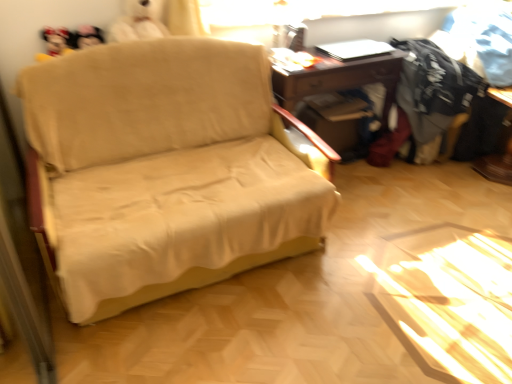
Describe the element at coordinates (485, 38) in the screenshot. I see `black printed fabric at upper right, which is the 1th clothing from right to left` at that location.

You are a GUI agent. You are given a task and a screenshot of the screen. Output one action in this format:
    pyautogui.click(x=<x>, y=<y>)
    Task: Click on the wooden desk at center
    This screenshot has height=384, width=512.
    Given the screenshot: What is the action you would take?
    pyautogui.click(x=338, y=78)

This screenshot has width=512, height=384. I want to click on beige fabric couch at center, so click(167, 170).

This screenshot has width=512, height=384. I want to click on black printed fabric at upper right, which is the 1th clothing from right to left, so pyautogui.click(x=485, y=38).

Considering the positions of objects beige fabric couch at center and dark gray cotton shirt at right, which is the 2th clothing in right-to-left order, in the image provided, who is behind, beige fabric couch at center or dark gray cotton shirt at right, which is the 2th clothing in right-to-left order,?

dark gray cotton shirt at right, which is the 2th clothing in right-to-left order.

From the image's perspective, is beige fabric couch at center above or below dark gray cotton shirt at right, which is the 2th clothing in right-to-left order?

From the image's perspective, beige fabric couch at center appears below dark gray cotton shirt at right, which is the 2th clothing in right-to-left order.

How distant is beige fabric couch at center from dark gray cotton shirt at right, which is the 2th clothing in right-to-left order?

beige fabric couch at center is 4.76 feet away from dark gray cotton shirt at right, which is the 2th clothing in right-to-left order.

Between point (194, 178) and point (429, 87), which one is positioned in front?

The point (194, 178) is closer to the camera.

Can you confirm if dark gray cotton shirt at right, which is the 2th clothing in right-to-left order, is smaller than wooden desk at center?

Yes, dark gray cotton shirt at right, which is the 2th clothing in right-to-left order, is smaller than wooden desk at center.

Does dark gray cotton shirt at right, arranged as the 1th clothing when viewed from the left, have a greater width compared to wooden desk at center?

Correct, the width of dark gray cotton shirt at right, arranged as the 1th clothing when viewed from the left, exceeds that of wooden desk at center.

Do you think dark gray cotton shirt at right, arranged as the 1th clothing when viewed from the left, is within wooden desk at center, or outside of it?

dark gray cotton shirt at right, arranged as the 1th clothing when viewed from the left, is not enclosed by wooden desk at center.

You are a GUI agent. You are given a task and a screenshot of the screen. Output one action in this format:
    pyautogui.click(x=<x>, y=<y>)
    Task: Click on the table that appears below the black printed fabric at upper right, which is the 1th clothing from right to left (from the image's perspective)
    This screenshot has height=384, width=512.
    Given the screenshot: What is the action you would take?
    pyautogui.click(x=338, y=78)

Between wooden desk at center and black printed fabric at upper right, which is the 1th clothing from right to left, which one has larger width?

black printed fabric at upper right, which is the 1th clothing from right to left.

Between wooden desk at center and black printed fabric at upper right, which is the 1th clothing from right to left, which one appears on the right side from the viewer's perspective?

black printed fabric at upper right, which is the 1th clothing from right to left, is more to the right.

Is wooden desk at center bigger than black printed fabric at upper right, arranged as the 2th clothing when viewed from the left?

Yes, wooden desk at center is bigger than black printed fabric at upper right, arranged as the 2th clothing when viewed from the left.

Identify the location of table that appears above the beige fabric couch at center (from the image's perspective). (338, 78).

Is the surface of wooden desk at center in direct contact with beige fabric couch at center?

No, wooden desk at center is not in contact with beige fabric couch at center.

Would you say wooden desk at center is outside beige fabric couch at center?

wooden desk at center lies outside beige fabric couch at center's area.

From the image's perspective, is wooden desk at center positioned above or below beige fabric couch at center?

Based on their image positions, wooden desk at center is located above beige fabric couch at center.

Is dark gray cotton shirt at right, which is the 2th clothing in right-to-left order, spatially inside beige fabric couch at center, or outside of it?

dark gray cotton shirt at right, which is the 2th clothing in right-to-left order, is outside beige fabric couch at center.

Considering the sizes of dark gray cotton shirt at right, which is the 2th clothing in right-to-left order, and beige fabric couch at center in the image, is dark gray cotton shirt at right, which is the 2th clothing in right-to-left order, bigger or smaller than beige fabric couch at center?

Considering their sizes, dark gray cotton shirt at right, which is the 2th clothing in right-to-left order, takes up less space than beige fabric couch at center.

Is dark gray cotton shirt at right, which is the 2th clothing in right-to-left order, thinner than beige fabric couch at center?

Yes, dark gray cotton shirt at right, which is the 2th clothing in right-to-left order, is thinner than beige fabric couch at center.

Between wooden desk at center and dark gray cotton shirt at right, arranged as the 1th clothing when viewed from the left, which one appears on the left side from the viewer's perspective?

From the viewer's perspective, wooden desk at center appears more on the left side.

From a real-world perspective, between wooden desk at center and dark gray cotton shirt at right, arranged as the 1th clothing when viewed from the left, who is vertically lower?

wooden desk at center, from a real-world perspective.

Between wooden desk at center and dark gray cotton shirt at right, arranged as the 1th clothing when viewed from the left, which one has smaller size?

dark gray cotton shirt at right, arranged as the 1th clothing when viewed from the left.

Which point is more distant from viewer, (341, 72) or (437, 110)?

The point (437, 110) is farther.

Does black printed fabric at upper right, arranged as the 2th clothing when viewed from the left, have a lesser height compared to dark gray cotton shirt at right, which is the 2th clothing in right-to-left order?

Correct, black printed fabric at upper right, arranged as the 2th clothing when viewed from the left, is not as tall as dark gray cotton shirt at right, which is the 2th clothing in right-to-left order.

Is black printed fabric at upper right, which is the 1th clothing from right to left, turned away from dark gray cotton shirt at right, arranged as the 1th clothing when viewed from the left?

No, black printed fabric at upper right, which is the 1th clothing from right to left, is not facing away from dark gray cotton shirt at right, arranged as the 1th clothing when viewed from the left.

How many degrees apart are the facing directions of black printed fabric at upper right, which is the 1th clothing from right to left, and dark gray cotton shirt at right, which is the 2th clothing in right-to-left order?

75.9 degrees.

From the image's perspective, which object appears higher, black printed fabric at upper right, arranged as the 2th clothing when viewed from the left, or dark gray cotton shirt at right, arranged as the 1th clothing when viewed from the left?

black printed fabric at upper right, arranged as the 2th clothing when viewed from the left, is shown above in the image.

Find the location of `clothing that is the 1st one when counting upward from the beige fabric couch at center (from the image's perspective)`. clothing that is the 1st one when counting upward from the beige fabric couch at center (from the image's perspective) is located at coordinates (434, 88).

Where is `table on the left of dark gray cotton shirt at right, which is the 2th clothing in right-to-left order`? This screenshot has height=384, width=512. table on the left of dark gray cotton shirt at right, which is the 2th clothing in right-to-left order is located at coordinates (338, 78).

Considering their positions, is beige fabric couch at center positioned closer to dark gray cotton shirt at right, which is the 2th clothing in right-to-left order, than black printed fabric at upper right, arranged as the 2th clothing when viewed from the left?

black printed fabric at upper right, arranged as the 2th clothing when viewed from the left, is closer to dark gray cotton shirt at right, which is the 2th clothing in right-to-left order.

Looking at the image, which one is located closer to black printed fabric at upper right, arranged as the 2th clothing when viewed from the left, wooden desk at center or beige fabric couch at center?

Based on the image, wooden desk at center appears to be nearer to black printed fabric at upper right, arranged as the 2th clothing when viewed from the left.

Estimate the real-world distances between objects in this image. Which object is further from wooden desk at center, black printed fabric at upper right, arranged as the 2th clothing when viewed from the left, or dark gray cotton shirt at right, which is the 2th clothing in right-to-left order?

black printed fabric at upper right, arranged as the 2th clothing when viewed from the left, is further to wooden desk at center.

Looking at the image, which one is located closer to dark gray cotton shirt at right, arranged as the 1th clothing when viewed from the left, wooden desk at center or beige fabric couch at center?

Based on the image, wooden desk at center appears to be nearer to dark gray cotton shirt at right, arranged as the 1th clothing when viewed from the left.

Estimate the real-world distances between objects in this image. Which object is closer to dark gray cotton shirt at right, arranged as the 1th clothing when viewed from the left, beige fabric couch at center or wooden desk at center?

Among the two, wooden desk at center is located nearer to dark gray cotton shirt at right, arranged as the 1th clothing when viewed from the left.

Estimate the real-world distances between objects in this image. Which object is closer to beige fabric couch at center, black printed fabric at upper right, which is the 1th clothing from right to left, or wooden desk at center?

wooden desk at center lies closer to beige fabric couch at center than the other object.

Looking at the image, which one is located further to beige fabric couch at center, dark gray cotton shirt at right, arranged as the 1th clothing when viewed from the left, or black printed fabric at upper right, arranged as the 2th clothing when viewed from the left?

black printed fabric at upper right, arranged as the 2th clothing when viewed from the left, is further to beige fabric couch at center.

Based on their spatial positions, is wooden desk at center or dark gray cotton shirt at right, which is the 2th clothing in right-to-left order, further from black printed fabric at upper right, which is the 1th clothing from right to left?

wooden desk at center.

Where is `clothing between wooden desk at center and black printed fabric at upper right, which is the 1th clothing from right to left, in the horizontal direction`? clothing between wooden desk at center and black printed fabric at upper right, which is the 1th clothing from right to left, in the horizontal direction is located at coordinates (434, 88).

The height and width of the screenshot is (384, 512). Identify the location of clothing between beige fabric couch at center and black printed fabric at upper right, arranged as the 2th clothing when viewed from the left, from left to right. (434, 88).

The height and width of the screenshot is (384, 512). Find the location of `table located between beige fabric couch at center and dark gray cotton shirt at right, which is the 2th clothing in right-to-left order, in the left-right direction`. table located between beige fabric couch at center and dark gray cotton shirt at right, which is the 2th clothing in right-to-left order, in the left-right direction is located at coordinates (338, 78).

This screenshot has width=512, height=384. Find the location of `table located between beige fabric couch at center and black printed fabric at upper right, which is the 1th clothing from right to left, in the left-right direction`. table located between beige fabric couch at center and black printed fabric at upper right, which is the 1th clothing from right to left, in the left-right direction is located at coordinates (338, 78).